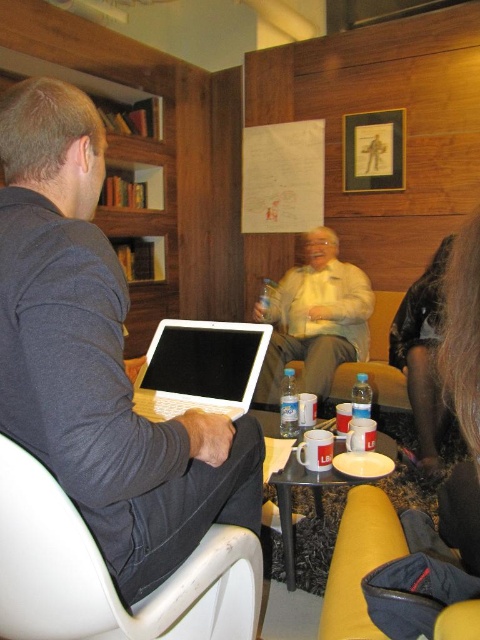
You are a photographer trying to capture a closeup of the black silky hair at lower right and the white plastic laptop at left. Since you want both objects to appear similarly sized in the photo, which object should you move closer to the camera?

Since the black silky hair at lower right is larger in size than the white plastic laptop at left, you should move the black silky hair at lower right closer to the camera to make them appear similar in size in the photo.

You are standing in the lounge and want to place a small plant between the two points, point (x=171, y=173) and point (x=394, y=376). Which point should the plant be closer to to ensure it is in front of the other point?

The plant should be closer to point (x=394, y=376) to ensure it is in front of point (x=171, y=173) since point (x=171, y=173) is behind point (x=394, y=376).